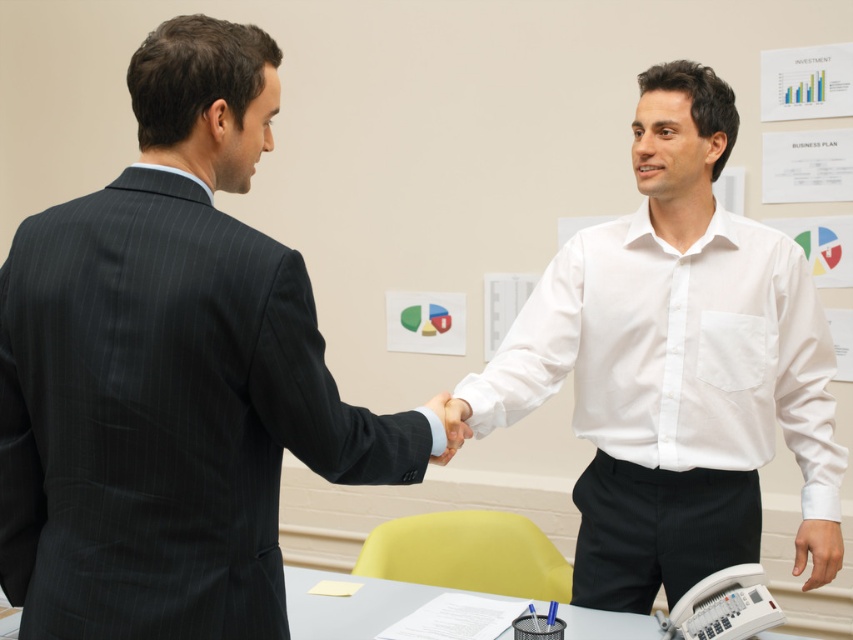
Question: Is the position of dark pinstripe suit at center less distant than that of white cotton shirt at right?

Choices:
 (A) yes
 (B) no

Answer: (A)

Question: Estimate the real-world distances between objects in this image. Which object is closer to the white matte hand at center?

Choices:
 (A) white cotton shirt at right
 (B) dark pinstripe suit at center

Answer: (B)

Question: Can you confirm if dark pinstripe suit at center is positioned below white cotton shirt at right?

Choices:
 (A) no
 (B) yes

Answer: (A)

Question: Among these objects, which one is nearest to the camera?

Choices:
 (A) white matte hand at center
 (B) dark pinstripe suit at center
 (C) white cotton shirt at right

Answer: (B)

Question: Estimate the real-world distances between objects in this image. Which object is farther from the white matte hand at center?

Choices:
 (A) white cotton shirt at right
 (B) dark pinstripe suit at center

Answer: (A)

Question: Considering the relative positions of dark pinstripe suit at center and white cotton shirt at right in the image provided, where is dark pinstripe suit at center located with respect to white cotton shirt at right?

Choices:
 (A) right
 (B) left

Answer: (B)